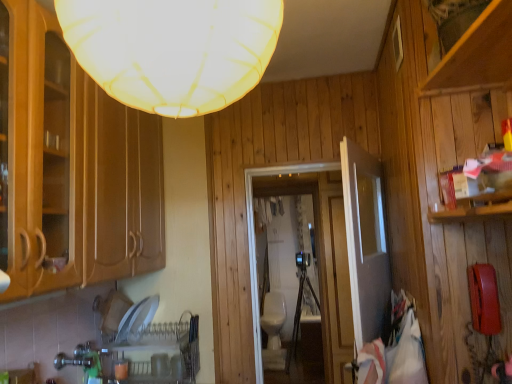
Question: From a real-world perspective, is white glossy sink at center located beneath transparent glass door at center?

Choices:
 (A) no
 (B) yes

Answer: (B)

Question: From a real-world perspective, is white glossy sink at center physically above transparent glass door at center?

Choices:
 (A) yes
 (B) no

Answer: (B)

Question: Is white glossy sink at center facing away from transparent glass door at center?

Choices:
 (A) yes
 (B) no

Answer: (B)

Question: Is white glossy sink at center outside transparent glass door at center?

Choices:
 (A) no
 (B) yes

Answer: (B)

Question: Does white glossy sink at center come in front of transparent glass door at center?

Choices:
 (A) no
 (B) yes

Answer: (A)

Question: In terms of width, does white glossy door at center look wider or thinner when compared to white glossy sink at center?

Choices:
 (A) thin
 (B) wide

Answer: (A)

Question: In terms of height, does white glossy door at center look taller or shorter compared to white glossy sink at center?

Choices:
 (A) tall
 (B) short

Answer: (A)

Question: Would you say white glossy door at center is inside or outside white glossy sink at center?

Choices:
 (A) outside
 (B) inside

Answer: (A)

Question: In the image, is white glossy door at center positioned in front of or behind white glossy sink at center?

Choices:
 (A) behind
 (B) front

Answer: (B)

Question: From the image's perspective, relative to transparent glass door at center, is white fabric lampshade at upper center above or below?

Choices:
 (A) below
 (B) above

Answer: (B)

Question: Is point (96, 71) positioned closer to the camera than point (251, 193)?

Choices:
 (A) closer
 (B) farther

Answer: (A)

Question: Is white fabric lampshade at upper center wider or thinner than transparent glass door at center?

Choices:
 (A) wide
 (B) thin

Answer: (A)

Question: Would you say white fabric lampshade at upper center is inside or outside transparent glass door at center?

Choices:
 (A) outside
 (B) inside

Answer: (A)

Question: Is white glossy sink at center situated inside transparent glass door at center or outside?

Choices:
 (A) inside
 (B) outside

Answer: (B)

Question: In terms of width, does white glossy sink at center look wider or thinner when compared to transparent glass door at center?

Choices:
 (A) thin
 (B) wide

Answer: (B)